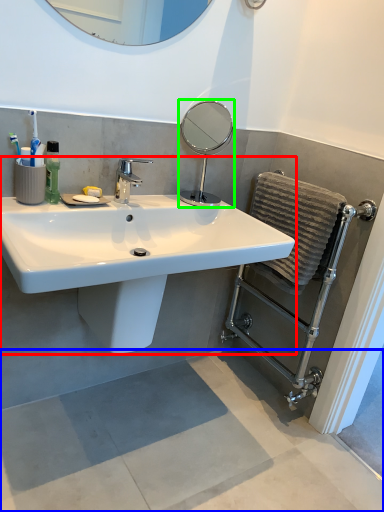
Question: Which is nearer to the sink (highlighted by a red box)? concrete (highlighted by a blue box) or mirror (highlighted by a green box).

Choices:
 (A) concrete
 (B) mirror

Answer: (A)